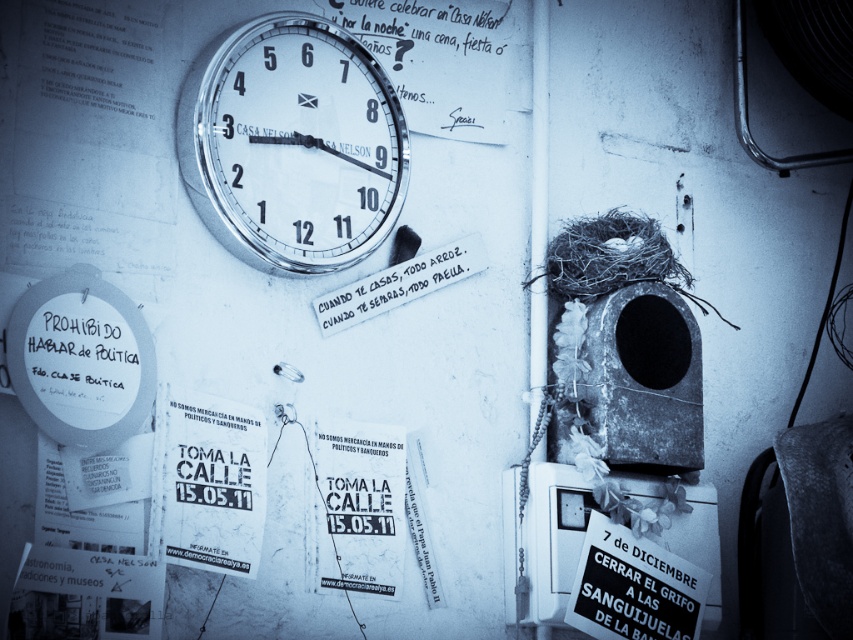
Does matte white sign at left have a larger size compared to matte white text at center?

No, matte white sign at left is not bigger than matte white text at center.

Find the location of `matte white sign at left`. matte white sign at left is located at coordinates (80, 355).

I want to click on matte white sign at left, so click(80, 355).

Can you confirm if white paper poster at center is smaller than matte white text at center?

Yes.

Is point (218, 458) positioned in front of point (383, 269)?

Yes, point (218, 458) is closer to viewer.

You are a GUI agent. You are given a task and a screenshot of the screen. Output one action in this format:
    pyautogui.click(x=<x>, y=<y>)
    Task: Click on the white paper poster at center
    
    Given the screenshot: What is the action you would take?
    pyautogui.click(x=212, y=483)

Is metallic clock at upper center to the right of white paper poster at center from the viewer's perspective?

Indeed, metallic clock at upper center is positioned on the right side of white paper poster at center.

Where is `metallic clock at upper center`? Image resolution: width=853 pixels, height=640 pixels. metallic clock at upper center is located at coordinates (292, 145).

Where is `metallic clock at upper center`? metallic clock at upper center is located at coordinates (292, 145).

You are a GUI agent. You are given a task and a screenshot of the screen. Output one action in this format:
    pyautogui.click(x=<x>, y=<y>)
    Task: Click on the metallic clock at upper center
    The height and width of the screenshot is (640, 853).
    Given the screenshot: What is the action you would take?
    pyautogui.click(x=292, y=145)